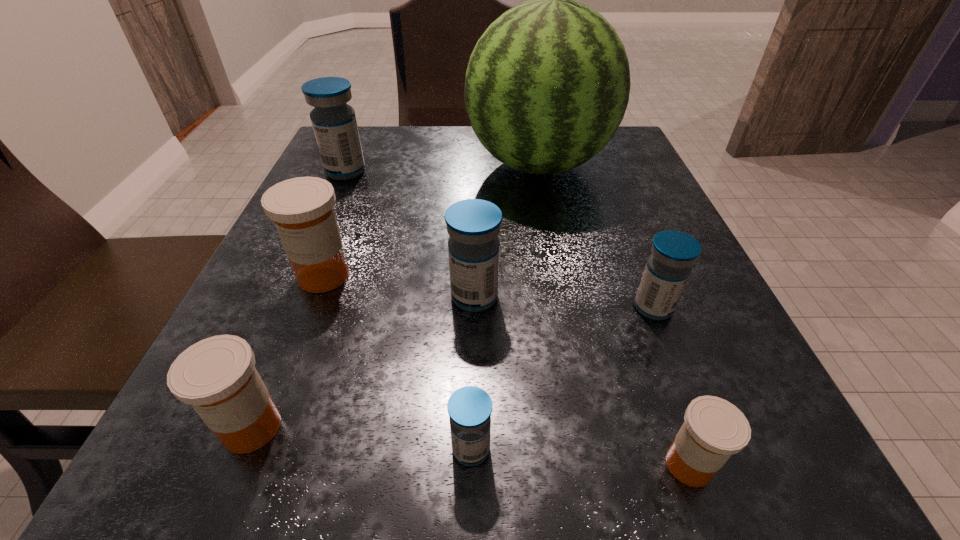
Where is `blank area in the image that satisfies the following two spatial constraints: 1. on the label of the biggest orange medicine; 2. on the right side of the third biggest blue medicine`? blank area in the image that satisfies the following two spatial constraints: 1. on the label of the biggest orange medicine; 2. on the right side of the third biggest blue medicine is located at coordinates (311, 308).

Image resolution: width=960 pixels, height=540 pixels. What are the coordinates of `blank area in the image that satisfies the following two spatial constraints: 1. on the back side of the watermelon; 2. on the right side of the third smallest blue medicine` in the screenshot? It's located at (476, 165).

Find the location of `vacant space that satisfies the following two spatial constraints: 1. on the label of the smallest blue medicine; 2. on the right side of the biggest orange medicine`. vacant space that satisfies the following two spatial constraints: 1. on the label of the smallest blue medicine; 2. on the right side of the biggest orange medicine is located at coordinates (257, 449).

At what (x,y) coordinates should I click in order to perform the action: click on vacant position in the image that satisfies the following two spatial constraints: 1. on the front side of the second smallest blue medicine; 2. on the left side of the second biggest blue medicine. Please return your answer as a coordinate pair (x, y). The width and height of the screenshot is (960, 540). Looking at the image, I should click on (474, 308).